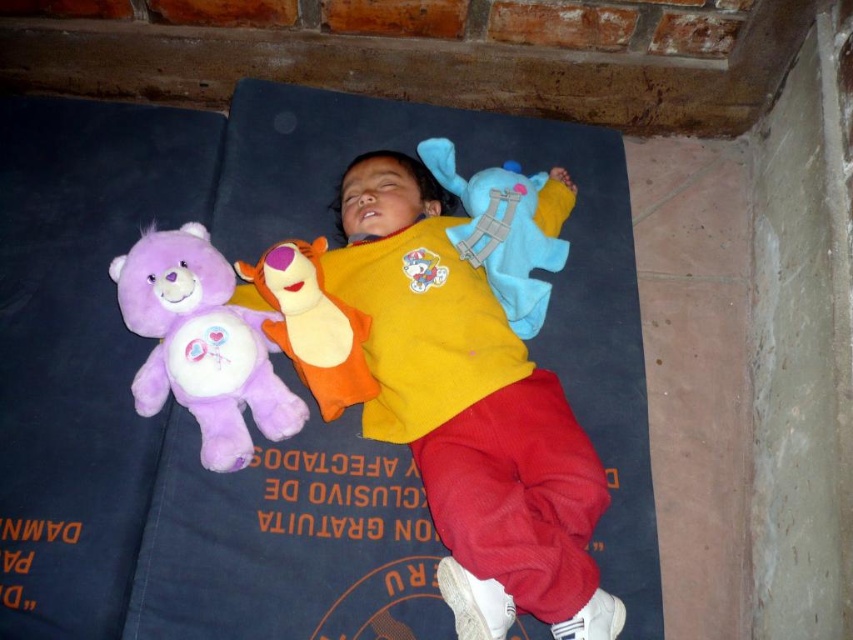
Measure the distance between yellow soft fabric shirt at center and purple plush tiger at center.

The distance of yellow soft fabric shirt at center from purple plush tiger at center is 4.98 inches.

Between point (379, 241) and point (306, 364), which one is positioned in front?

Point (306, 364)

The height and width of the screenshot is (640, 853). What do you see at coordinates (454, 384) in the screenshot?
I see `yellow soft fabric shirt at center` at bounding box center [454, 384].

Find the location of `yellow soft fabric shirt at center`. yellow soft fabric shirt at center is located at coordinates (454, 384).

What do you see at coordinates (202, 344) in the screenshot? The width and height of the screenshot is (853, 640). I see `purple plush bear at left` at bounding box center [202, 344].

Is purple plush bear at left wider than purple plush tiger at center?

Indeed, purple plush bear at left has a greater width compared to purple plush tiger at center.

You are a GUI agent. You are given a task and a screenshot of the screen. Output one action in this format:
    pyautogui.click(x=<x>, y=<y>)
    Task: Click on the purple plush bear at left
    This screenshot has width=853, height=640.
    Given the screenshot: What is the action you would take?
    point(202,344)

At what (x,y) coordinates should I click in order to perform the action: click on purple plush bear at left. Please return your answer as a coordinate pair (x, y). Looking at the image, I should click on (202, 344).

Does purple plush bear at left appear on the right side of blue plush toy at upper center?

Incorrect, purple plush bear at left is not on the right side of blue plush toy at upper center.

Between point (126, 307) and point (451, 177), which one is positioned in front?

Point (126, 307) is more forward.

At what (x,y) coordinates should I click in order to perform the action: click on purple plush bear at left. Please return your answer as a coordinate pair (x, y). Looking at the image, I should click on (202, 344).